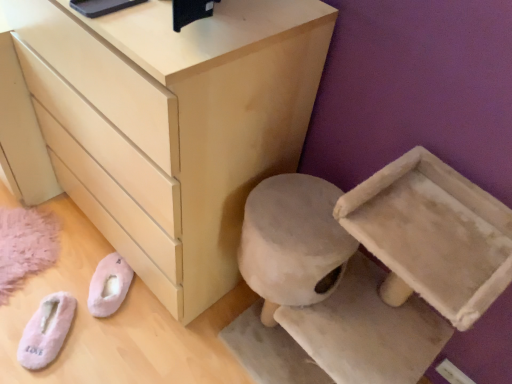
Question: Considering the relative sizes of pink fuzzy slippers at lower left, the 1th footwear from the right, and pink fluffy slippers at lower left, which is counted as the second footwear, starting from the right, in the image provided, is pink fuzzy slippers at lower left, the 1th footwear from the right, thinner than pink fluffy slippers at lower left, which is counted as the second footwear, starting from the right,?

Choices:
 (A) no
 (B) yes

Answer: (A)

Question: Is the depth of pink fuzzy slippers at lower left, the second footwear when ordered from left to right, less than that of pink fluffy slippers at lower left, which ranks as the first footwear in left-to-right order?

Choices:
 (A) yes
 (B) no

Answer: (B)

Question: Is pink fuzzy slippers at lower left, the second footwear when ordered from left to right, at the right side of pink fluffy slippers at lower left, which is counted as the second footwear, starting from the right?

Choices:
 (A) yes
 (B) no

Answer: (A)

Question: From the image's perspective, would you say pink fuzzy slippers at lower left, the 1th footwear from the right, is positioned over pink fluffy slippers at lower left, which is counted as the second footwear, starting from the right?

Choices:
 (A) yes
 (B) no

Answer: (A)

Question: Can you confirm if pink fuzzy slippers at lower left, the second footwear when ordered from left to right, is bigger than pink fluffy slippers at lower left, which is counted as the second footwear, starting from the right?

Choices:
 (A) no
 (B) yes

Answer: (A)

Question: Is pink fuzzy slippers at lower left, the second footwear when ordered from left to right, shorter than pink fluffy slippers at lower left, which is counted as the second footwear, starting from the right?

Choices:
 (A) no
 (B) yes

Answer: (A)

Question: Can you confirm if pink fuzzy slippers at lower left, the 1th footwear from the right, is wider than matte light wood chest of drawers at center?

Choices:
 (A) yes
 (B) no

Answer: (B)

Question: Is pink fuzzy slippers at lower left, the second footwear when ordered from left to right, turned away from matte light wood chest of drawers at center?

Choices:
 (A) no
 (B) yes

Answer: (B)

Question: From a real-world perspective, is pink fuzzy slippers at lower left, the second footwear when ordered from left to right, on matte light wood chest of drawers at center?

Choices:
 (A) no
 (B) yes

Answer: (A)

Question: Is pink fuzzy slippers at lower left, the second footwear when ordered from left to right, at the right side of matte light wood chest of drawers at center?

Choices:
 (A) yes
 (B) no

Answer: (B)

Question: From the image's perspective, does pink fuzzy slippers at lower left, the second footwear when ordered from left to right, appear lower than matte light wood chest of drawers at center?

Choices:
 (A) no
 (B) yes

Answer: (B)

Question: Is pink fuzzy slippers at lower left, the 1th footwear from the right, at the left side of matte light wood chest of drawers at center?

Choices:
 (A) yes
 (B) no

Answer: (A)

Question: From the image's perspective, does pink fluffy slippers at lower left, which is counted as the second footwear, starting from the right, appear lower than pink fuzzy slippers at lower left, the 1th footwear from the right?

Choices:
 (A) no
 (B) yes

Answer: (B)